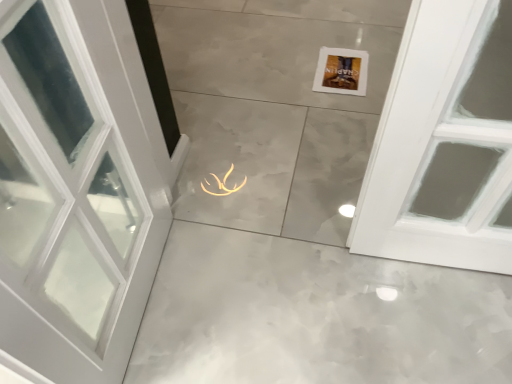
This screenshot has height=384, width=512. In order to click on free space to the left of matte gold postcard at upper right in this screenshot , I will do `click(287, 75)`.